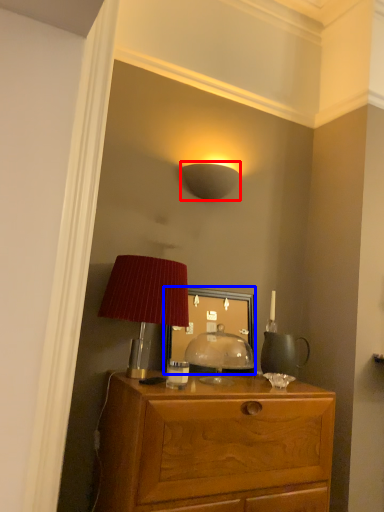
Question: Which of the following is the farthest to the observer, lamp (highlighted by a red box) or mirror (highlighted by a blue box)?

Choices:
 (A) lamp
 (B) mirror

Answer: (A)